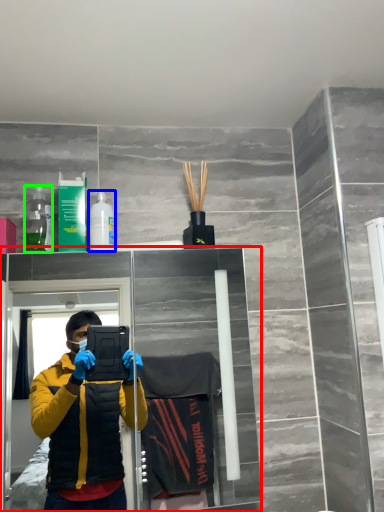
Question: Considering the real-world distances, which object is closest to glass door (highlighted by a red box)? toiletry (highlighted by a blue box) or bottle (highlighted by a green box).

Choices:
 (A) toiletry
 (B) bottle

Answer: (A)